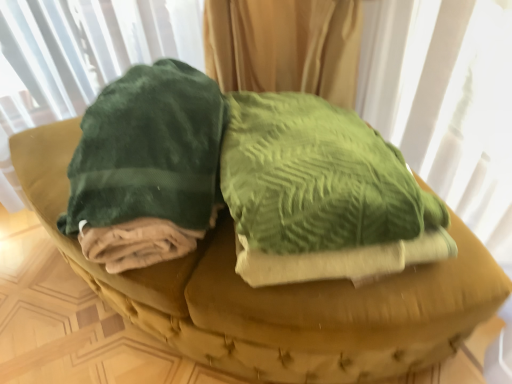
The height and width of the screenshot is (384, 512). Describe the element at coordinates (275, 295) in the screenshot. I see `velvet green cushion at center` at that location.

Locate an element on the screen. Image resolution: width=512 pixels, height=384 pixels. velvet green cushion at center is located at coordinates (275, 295).

This screenshot has height=384, width=512. What do you see at coordinates (147, 167) in the screenshot? I see `velvety green blanket at left` at bounding box center [147, 167].

The image size is (512, 384). I want to click on velvety green blanket at left, so click(147, 167).

Measure the distance between velvety green blanket at left and camera.

36.57 inches.

Find the location of a particular element. The image size is (512, 384). velvet green cushion at center is located at coordinates click(275, 295).

Is velvet green cushion at center to the right of velvety green blanket at left from the viewer's perspective?

Correct, you'll find velvet green cushion at center to the right of velvety green blanket at left.

Who is more distant, velvet green cushion at center or velvety green blanket at left?

velvety green blanket at left is more distant.

Which is nearer, (329, 324) or (110, 241)?

The point (329, 324) is closer to the camera.

From the image's perspective, is velvet green cushion at center located beneath velvety green blanket at left?

Yes, from the image's perspective, velvet green cushion at center is below velvety green blanket at left.

From a real-world perspective, which object rests below the other?

From a 3D spatial view, velvet green cushion at center is below.

Between velvet green cushion at center and velvety green blanket at left, which one has larger width?

With larger width is velvet green cushion at center.

Between velvet green cushion at center and velvety green blanket at left, which one has more height?

velvet green cushion at center is taller.

Is velvet green cushion at center bigger than velvety green blanket at left?

Correct, velvet green cushion at center is larger in size than velvety green blanket at left.

Could velvety green blanket at left be considered to be inside velvet green cushion at center?

That's incorrect, velvety green blanket at left is not inside velvet green cushion at center.

Is velvet green cushion at center not close to velvety green blanket at left?

They are positioned close to each other.

Is velvet green cushion at center oriented towards velvety green blanket at left?

No, velvet green cushion at center is not facing towards velvety green blanket at left.

In the scene shown: Can you tell me how much velvet green cushion at center and velvety green blanket at left differ in facing direction?

12.4 degrees.

Locate an element on the screen. The width and height of the screenshot is (512, 384). cloth lying above the velvet green cushion at center (from the image's perspective) is located at coordinates (147, 167).

Can you confirm if velvety green blanket at left is positioned to the left of velvet green cushion at center?

Correct, you'll find velvety green blanket at left to the left of velvet green cushion at center.

Is velvety green blanket at left further to camera compared to velvet green cushion at center?

Yes, velvety green blanket at left is further from the camera.

Considering the points (120, 155) and (222, 239), which point is in front, point (120, 155) or point (222, 239)?

The point (120, 155) is closer to the camera.

From the image's perspective, which object appears higher, velvety green blanket at left or velvet green cushion at center?

From the image's view, velvety green blanket at left is above.

From a real-world perspective, is velvety green blanket at left below velvet green cushion at center?

No, from a real-world perspective, velvety green blanket at left is not beneath velvet green cushion at center.

Is velvety green blanket at left thinner than velvet green cushion at center?

Yes.

From their relative heights in the image, would you say velvety green blanket at left is taller or shorter than velvet green cushion at center?

Considering their sizes, velvety green blanket at left has less height than velvet green cushion at center.

Which of these two, velvety green blanket at left or velvet green cushion at center, is smaller?

With smaller size is velvety green blanket at left.

Do you think velvety green blanket at left is within velvet green cushion at center, or outside of it?

velvety green blanket at left exists outside the volume of velvet green cushion at center.

Is velvety green blanket at left with velvet green cushion at center?

No, velvety green blanket at left is not next to velvet green cushion at center.

Is velvety green blanket at left facing towards velvet green cushion at center?

No.

The height and width of the screenshot is (384, 512). In order to click on cloth that is behind the velvet green cushion at center in this screenshot , I will do `click(147, 167)`.

Where is `cloth that appears above the velvet green cushion at center (from the image's perspective)`? The width and height of the screenshot is (512, 384). cloth that appears above the velvet green cushion at center (from the image's perspective) is located at coordinates (147, 167).

The width and height of the screenshot is (512, 384). I want to click on cloth on the left of velvet green cushion at center, so click(x=147, y=167).